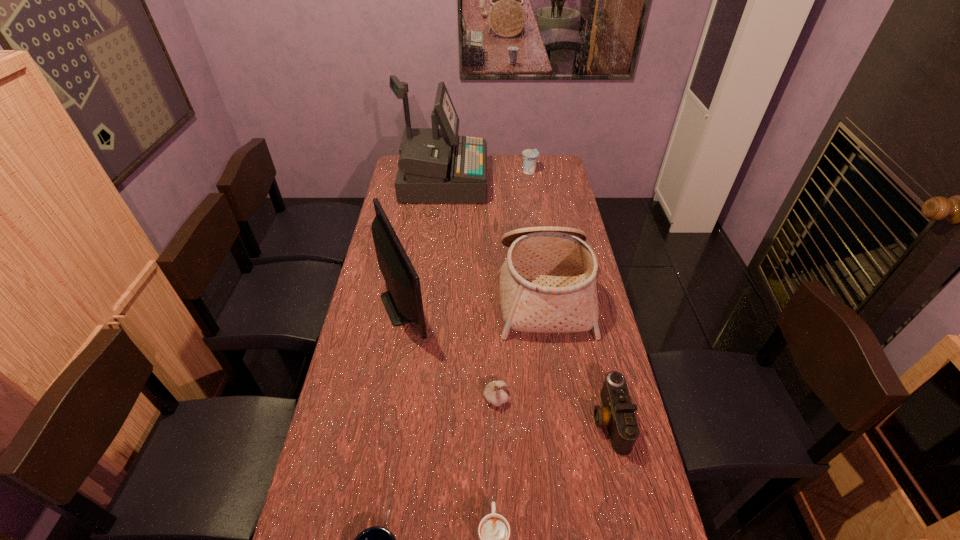
Image resolution: width=960 pixels, height=540 pixels. Find the location of `basket that is at the right edge`. basket that is at the right edge is located at coordinates (547, 284).

Locate an element on the screen. yogurt at the right edge is located at coordinates (530, 156).

You are a GUI agent. You are given a task and a screenshot of the screen. Output one action in this format:
    pyautogui.click(x=<x>, y=<y>)
    Task: Click on the camera present at the right edge
    This screenshot has height=540, width=960.
    Given the screenshot: What is the action you would take?
    pyautogui.click(x=617, y=413)

The height and width of the screenshot is (540, 960). Find the location of `object situated at the far left corner`. object situated at the far left corner is located at coordinates (436, 165).

At what (x,y) coordinates should I click in order to perform the action: click on object that is at the far right corner. Please return your answer as a coordinate pair (x, y). The height and width of the screenshot is (540, 960). Looking at the image, I should click on (530, 156).

The width and height of the screenshot is (960, 540). Identify the location of free space at the far edge of the desktop. (504, 158).

At what (x,y) coordinates should I click in order to perform the action: click on free space at the left edge of the desktop. Please return your answer as a coordinate pair (x, y). The image size is (960, 540). Looking at the image, I should click on (408, 230).

In the image, there is a desktop. Identify the location of vacant space at the right edge. This screenshot has height=540, width=960. (576, 334).

The height and width of the screenshot is (540, 960). I want to click on free space between the camera and the garlic, so click(553, 409).

Where is `vacant space in between the second tallest object and the camera`? vacant space in between the second tallest object and the camera is located at coordinates [508, 362].